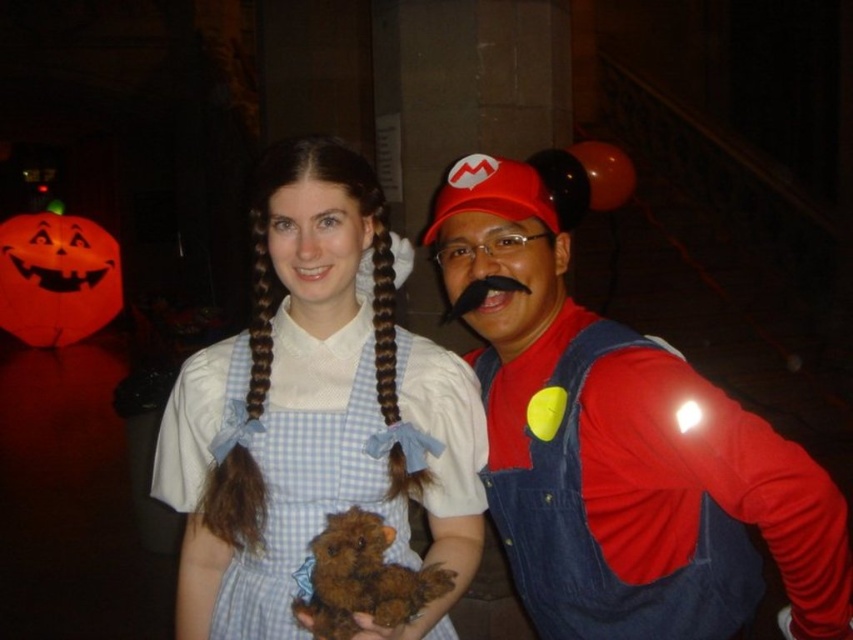
In the scene shown: You are a photographer taking a picture of the two costumed individuals in the scene. You want to focus on the point at point [252,316] and point [347,525]. Which point is closer to your camera?

Point [347,525] is closer to the camera than point [252,316] because the latter is further away from the camera.

You are standing in the center of the room and want to move towards the blue checkered dress at center. Which direction should you move?

The blue checkered dress at center is located at point coordinates, so you should move towards the coordinates to reach it.